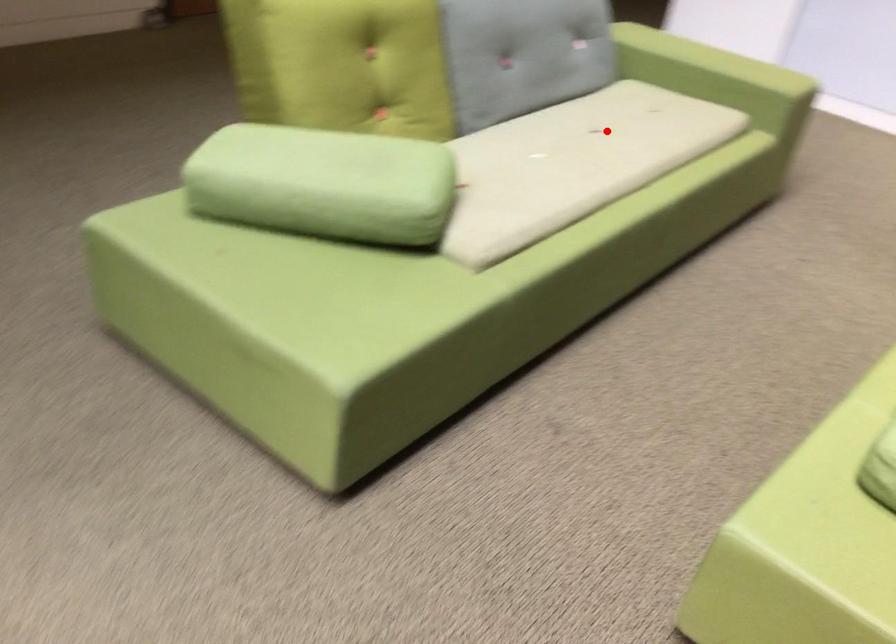
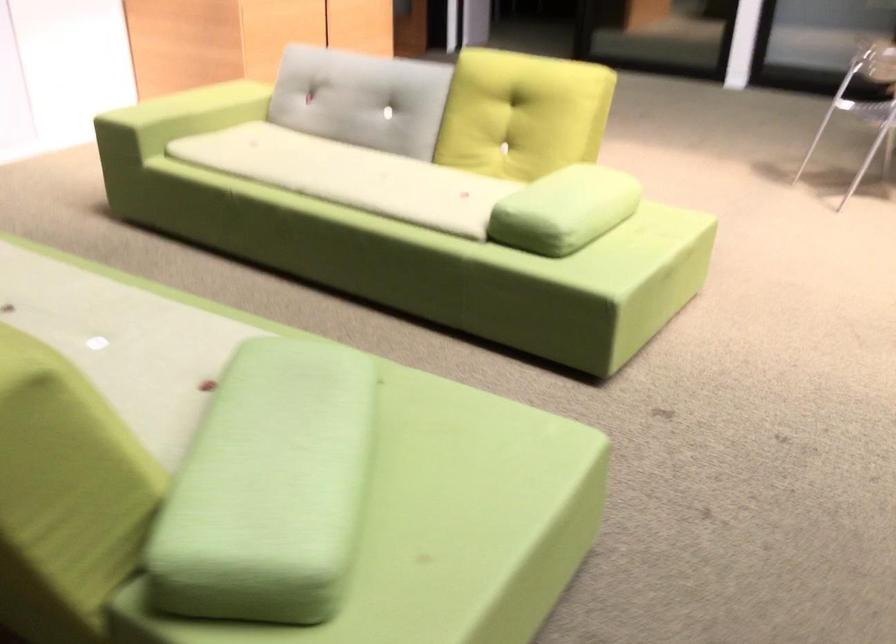
Locate, in the second image, the point that corresponds to the highlighted location in the first image.

(66, 290)